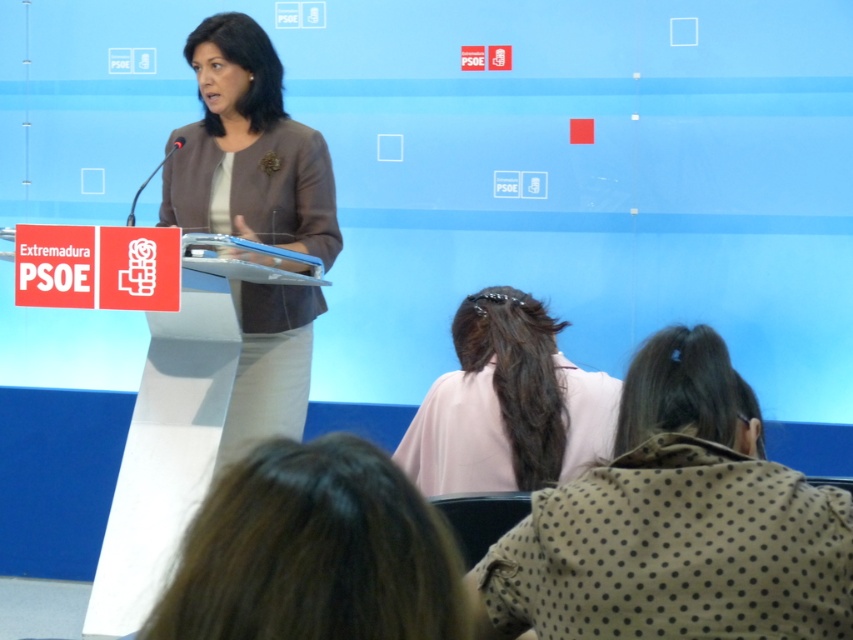
Is brown dotted fabric at lower center further to camera compared to brown hair at lower center?

Yes, brown dotted fabric at lower center is further from the viewer.

Is brown dotted fabric at lower center wider than brown hair at lower center?

Indeed, brown dotted fabric at lower center has a greater width compared to brown hair at lower center.

Where is `brown dotted fabric at lower center`? brown dotted fabric at lower center is located at coordinates (676, 524).

What are the coordinates of `brown dotted fabric at lower center` in the screenshot? It's located at (676, 524).

Between brown dotted fabric at lower center and light pink fabric at center, which one has more height?

brown dotted fabric at lower center

Does brown dotted fabric at lower center have a larger size compared to light pink fabric at center?

Correct, brown dotted fabric at lower center is larger in size than light pink fabric at center.

At what (x,y) coordinates should I click in order to perform the action: click on brown dotted fabric at lower center. Please return your answer as a coordinate pair (x, y). Looking at the image, I should click on (676, 524).

Is brown dotted fabric at lower center smaller than matte brown blazer at center?

Yes.

Consider the image. Is brown dotted fabric at lower center positioned in front of matte brown blazer at center?

That is True.

Measure the distance between point (751, 560) and camera.

The distance of point (751, 560) from camera is 1.33 meters.

You are a GUI agent. You are given a task and a screenshot of the screen. Output one action in this format:
    pyautogui.click(x=<x>, y=<y>)
    Task: Click on the brown dotted fabric at lower center
    The width and height of the screenshot is (853, 640).
    Given the screenshot: What is the action you would take?
    pyautogui.click(x=676, y=524)